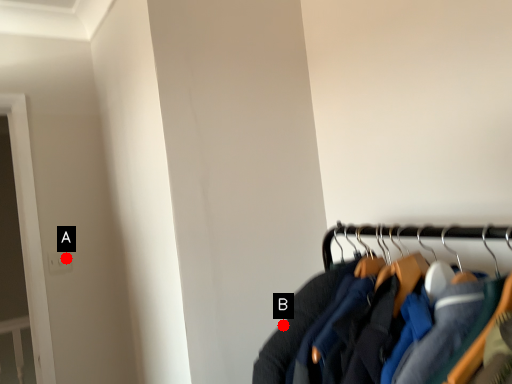
Question: Two points are circled on the image, labeled by A and B beside each circle. Among these points, which one is farthest from the camera?

Choices:
 (A) A is further
 (B) B is further

Answer: (A)